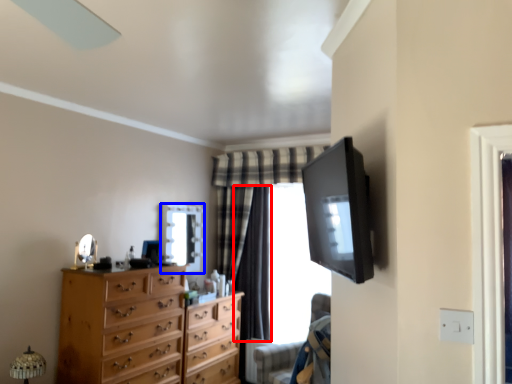
Question: Which point is closer to the camera, curtain (highlighted by a red box) or mirror (highlighted by a blue box)?

Choices:
 (A) curtain
 (B) mirror

Answer: (B)